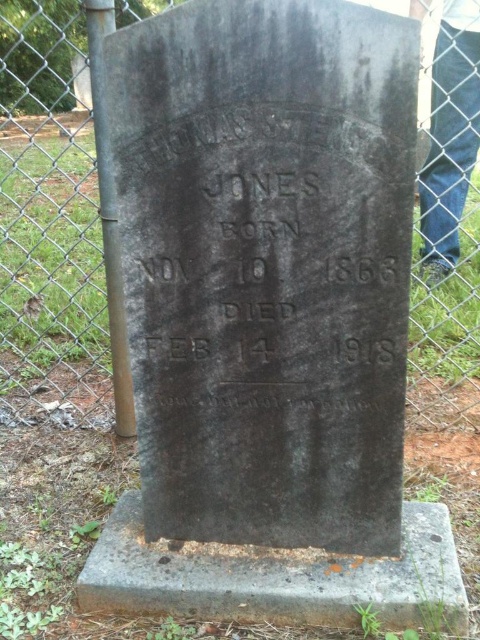
You are standing at the point with coordinates closest to the gravestone. There are two points marked in the image, one at coordinates point (52, 396) and another at point (145, 570). Which of these points is closer to you?

Point (145, 570) is closer to you because it is in front of point (52, 396).